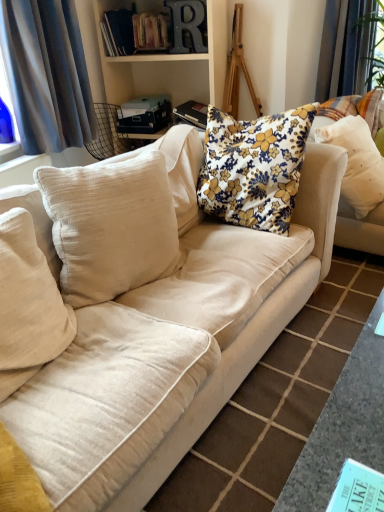
Question: Based on their positions, is beige cotton pillow at left, which is the fourth pillow in right-to-left order, located to the left or right of floral fabric book at upper center, arranged as the second book when ordered from the bottom?

Choices:
 (A) right
 (B) left

Answer: (B)

Question: From their relative heights in the image, would you say beige cotton pillow at left, which is the fourth pillow in right-to-left order, is taller or shorter than floral fabric book at upper center, arranged as the second book when ordered from the bottom?

Choices:
 (A) tall
 (B) short

Answer: (A)

Question: Which object is positioned closest to the beige cotton pillow at left, which is the fourth pillow in right-to-left order?

Choices:
 (A) black hardcover book at upper center, which is the 3th book from front to back
 (B) beige fabric couch at center
 (C) teal paper book at lower right, acting as the fourth book starting from the top
 (D) hardcover books at upper center, which is the second book in front-to-back order
 (E) gray fabric curtain at left

Answer: (B)

Question: Which object is positioned closest to the black hardcover book at upper center, the first book when ordered from left to right?

Choices:
 (A) white textured pillow at upper right, which ranks as the 4th pillow in left-to-right order
 (B) beige fabric couch at center
 (C) floral fabric cushion at center, the 2th pillow in the right-to-left sequence
 (D) gray fabric curtain at left
 (E) beige cotton pillow at left, which appears as the second pillow when viewed from the left

Answer: (D)